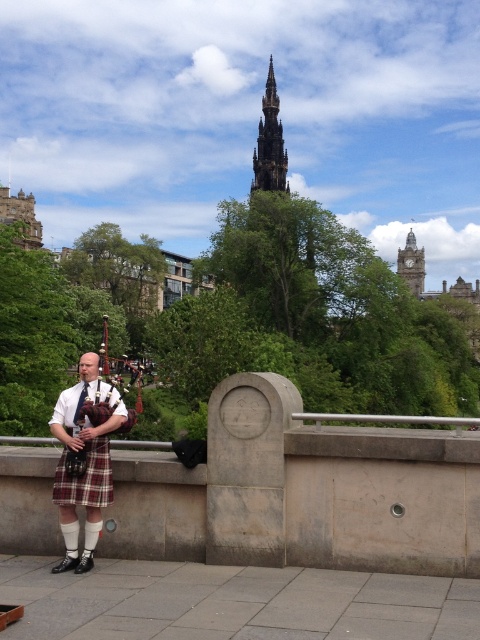
You are a tourist in Edinburgh and see the plaid fabric kilt at left and the polished wood bagpipes at left. Which object is positioned lower in the image?

The plaid fabric kilt at left is positioned lower than the polished wood bagpipes at left in the image.

You are a photographer trying to capture the plaid fabric kilt at left and the polished wood bagpipes at left in a single shot. Which object will appear narrower in the photo?

The plaid fabric kilt at left will appear narrower in the photo because it is thinner than the polished wood bagpipes at left.